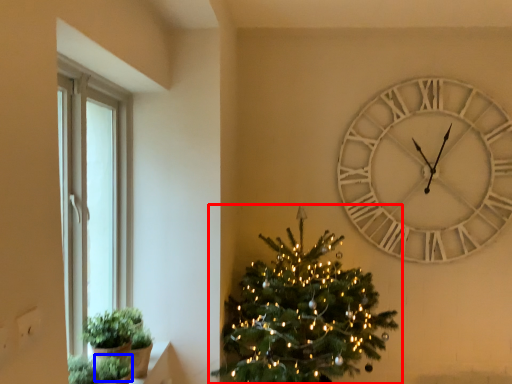
Question: Which point is further to the camera, christmas tree (highlighted by a red box) or plant (highlighted by a blue box)?

Choices:
 (A) christmas tree
 (B) plant

Answer: (A)